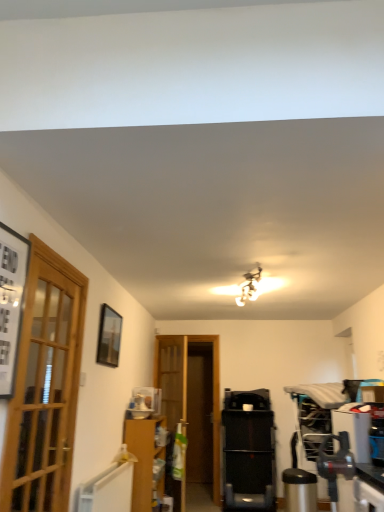
Find the location of a particular element. wooden door at center, placed as the first door when sorted from back to front is located at coordinates (172, 399).

Describe the element at coordinates (109, 336) in the screenshot. The image size is (384, 512). I see `matte black picture frame at upper left, which appears as the 1th picture frame when viewed from the right` at that location.

Measure the distance between matte black picture frame at upper left, which appears as the 1th picture frame when viewed from the right, and camera.

The distance of matte black picture frame at upper left, which appears as the 1th picture frame when viewed from the right, from camera is 3.26 meters.

Locate an element on the screen. Image resolution: width=384 pixels, height=512 pixels. black matte picture frame at left, which is counted as the 1th picture frame, starting from the front is located at coordinates (11, 302).

I want to click on wooden glass door at left, acting as the second door starting from the back, so click(45, 386).

From the image's perspective, is wooden glass door at left, acting as the second door starting from the back, positioned above or below matte black picture frame at upper left, which appears as the 1th picture frame when viewed from the right?

Based on their image positions, wooden glass door at left, acting as the second door starting from the back, is located beneath matte black picture frame at upper left, which appears as the 1th picture frame when viewed from the right.

Which object is thinner, wooden glass door at left, which is the 1th door from front to back, or matte black picture frame at upper left, which is the 2th picture frame in left-to-right order?

Thinner between the two is matte black picture frame at upper left, which is the 2th picture frame in left-to-right order.

Are wooden glass door at left, arranged as the second door when viewed from the right, and matte black picture frame at upper left, placed as the first picture frame when sorted from back to front, beside each other?

wooden glass door at left, arranged as the second door when viewed from the right, and matte black picture frame at upper left, placed as the first picture frame when sorted from back to front, are not in contact.

Is wooden glass door at left, arranged as the second door when viewed from the right, not within matte black picture frame at upper left, which is the 2th picture frame in left-to-right order?

wooden glass door at left, arranged as the second door when viewed from the right, lies outside matte black picture frame at upper left, which is the 2th picture frame in left-to-right order,'s area.

Considering the sizes of objects matte black picture frame at upper left, placed as the first picture frame when sorted from back to front, and black plastic treadmill at center in the image provided, who is wider, matte black picture frame at upper left, placed as the first picture frame when sorted from back to front, or black plastic treadmill at center?

Wider between the two is black plastic treadmill at center.

The width and height of the screenshot is (384, 512). I want to click on the 1st picture frame counting from the left of the black plastic treadmill at center, so click(x=109, y=336).

Is matte black picture frame at upper left, which is counted as the second picture frame, starting from the front, positioned in front of black plastic treadmill at center?

Yes, matte black picture frame at upper left, which is counted as the second picture frame, starting from the front, is closer to the viewer.

Is matte black picture frame at upper left, which is counted as the second picture frame, starting from the front, looking in the opposite direction of black plastic treadmill at center?

No, black plastic treadmill at center is not at the back of matte black picture frame at upper left, which is counted as the second picture frame, starting from the front.

Is black plastic treadmill at center closer to camera compared to wooden door at center, marked as the second door in a front-to-back arrangement?

Yes, it is.

The width and height of the screenshot is (384, 512). Identify the location of door behind the black plastic treadmill at center. (172, 399).

Considering the relative sizes of black plastic treadmill at center and wooden door at center, the 2th door from the left, in the image provided, is black plastic treadmill at center bigger than wooden door at center, the 2th door from the left,?

Yes.

From a real-world perspective, which object stands above the other?

wooden door at center, placed as the first door when sorted from back to front, is physically above.

Is brown cardboard cabinet at lower left positioned with its back to wooden glass door at left, which is the 1th door from front to back?

brown cardboard cabinet at lower left does not have its back to wooden glass door at left, which is the 1th door from front to back.

From the image's perspective, which object appears higher, brown cardboard cabinet at lower left or wooden glass door at left, which is the 1th door from front to back?

wooden glass door at left, which is the 1th door from front to back.

Does brown cardboard cabinet at lower left come behind wooden glass door at left, acting as the second door starting from the back?

Yes, the depth of brown cardboard cabinet at lower left is greater than that of wooden glass door at left, acting as the second door starting from the back.

Where is `the 2nd door above the brown cardboard cabinet at lower left (from the image's perspective)`? The height and width of the screenshot is (512, 384). the 2nd door above the brown cardboard cabinet at lower left (from the image's perspective) is located at coordinates (45, 386).

Could you tell me if black matte picture frame at left, which is the second picture frame from back to front, is facing black plastic treadmill at center?

No, black matte picture frame at left, which is the second picture frame from back to front, is not oriented towards black plastic treadmill at center.

Which point is more forward, (6, 372) or (249, 503)?

Point (6, 372)

Is black matte picture frame at left, positioned as the second picture frame in right-to-left order, at the left side of black plastic treadmill at center?

Yes.

Can black plastic treadmill at center be found inside black matte picture frame at left, which is counted as the 1th picture frame, starting from the front?

No.

Would you say wooden glass door at left, arranged as the second door when viewed from the right, is part of black matte picture frame at left, positioned as the second picture frame in right-to-left order,'s contents?

No, wooden glass door at left, arranged as the second door when viewed from the right, is located outside of black matte picture frame at left, positioned as the second picture frame in right-to-left order.

Which is more to the right, black matte picture frame at left, positioned as the second picture frame in right-to-left order, or wooden glass door at left, which is counted as the 1th door, starting from the left?

wooden glass door at left, which is counted as the 1th door, starting from the left.

Consider the image. Which object is thinner, black matte picture frame at left, which is counted as the 1th picture frame, starting from the front, or wooden glass door at left, arranged as the second door when viewed from the right?

Thinner between the two is black matte picture frame at left, which is counted as the 1th picture frame, starting from the front.

Is black matte picture frame at left, positioned as the second picture frame in right-to-left order, far away from wooden glass door at left, acting as the second door starting from the back?

No, there isn't a large distance between black matte picture frame at left, positioned as the second picture frame in right-to-left order, and wooden glass door at left, acting as the second door starting from the back.

Looking at this image, is matte black picture frame at upper left, placed as the first picture frame when sorted from back to front, oriented away from brown cardboard cabinet at lower left?

matte black picture frame at upper left, placed as the first picture frame when sorted from back to front, does not have its back to brown cardboard cabinet at lower left.

Can you confirm if matte black picture frame at upper left, placed as the first picture frame when sorted from back to front, is bigger than brown cardboard cabinet at lower left?

No, matte black picture frame at upper left, placed as the first picture frame when sorted from back to front, is not bigger than brown cardboard cabinet at lower left.

Is matte black picture frame at upper left, which is counted as the second picture frame, starting from the front, closer to the viewer compared to brown cardboard cabinet at lower left?

Yes, matte black picture frame at upper left, which is counted as the second picture frame, starting from the front, is closer to the viewer.

Based on the photo, is matte black picture frame at upper left, which is counted as the second picture frame, starting from the front, not close to brown cardboard cabinet at lower left?

Yes, matte black picture frame at upper left, which is counted as the second picture frame, starting from the front, and brown cardboard cabinet at lower left are located far from each other.

From the image's perspective, which picture frame is the 1st one above the wooden glass door at left, which is counted as the 1th door, starting from the left? Please provide its 2D coordinates.

[(109, 336)]

The width and height of the screenshot is (384, 512). Find the location of `appliance located behind the matte black picture frame at upper left, which appears as the 1th picture frame when viewed from the right`. appliance located behind the matte black picture frame at upper left, which appears as the 1th picture frame when viewed from the right is located at coordinates (248, 460).

From the image, which object appears to be farther from wooden door at center, the 1th door in the right-to-left sequence, wooden glass door at left, arranged as the second door when viewed from the right, or black matte picture frame at left, which is counted as the 1th picture frame, starting from the front?

black matte picture frame at left, which is counted as the 1th picture frame, starting from the front.

From the picture: Estimate the real-world distances between objects in this image. Which object is further from wooden glass door at left, which is the 1th door from front to back, black plastic treadmill at center or matte black picture frame at upper left, which appears as the 1th picture frame when viewed from the right?

black plastic treadmill at center is positioned further to the anchor wooden glass door at left, which is the 1th door from front to back.

When comparing their distances from black matte picture frame at left, positioned as the second picture frame in right-to-left order, does wooden door at center, placed as the first door when sorted from back to front, or matte black picture frame at upper left, placed as the first picture frame when sorted from back to front, seem closer?

matte black picture frame at upper left, placed as the first picture frame when sorted from back to front, is closer to black matte picture frame at left, positioned as the second picture frame in right-to-left order.

Considering their positions, is black matte picture frame at left, which is counted as the 1th picture frame, starting from the front, positioned closer to matte black picture frame at upper left, which is the 2th picture frame in left-to-right order, than brown cardboard cabinet at lower left?

brown cardboard cabinet at lower left is positioned closer to the anchor matte black picture frame at upper left, which is the 2th picture frame in left-to-right order.

Looking at the image, which one is located closer to black plastic treadmill at center, wooden door at center, marked as the second door in a front-to-back arrangement, or wooden glass door at left, arranged as the second door when viewed from the right?

wooden door at center, marked as the second door in a front-to-back arrangement, is closer to black plastic treadmill at center.

From the image, which object appears to be farther from wooden door at center, the 2th door from the left, black matte picture frame at left, which is the second picture frame from back to front, or matte black picture frame at upper left, placed as the first picture frame when sorted from back to front?

black matte picture frame at left, which is the second picture frame from back to front, is positioned further to the anchor wooden door at center, the 2th door from the left.

Estimate the real-world distances between objects in this image. Which object is closer to wooden glass door at left, which is the 1th door from front to back, black matte picture frame at left, positioned as the second picture frame in right-to-left order, or brown cardboard cabinet at lower left?

black matte picture frame at left, positioned as the second picture frame in right-to-left order.

Which object lies further to the anchor point brown cardboard cabinet at lower left, wooden glass door at left, arranged as the second door when viewed from the right, or wooden door at center, marked as the second door in a front-to-back arrangement?

wooden glass door at left, arranged as the second door when viewed from the right, is further to brown cardboard cabinet at lower left.

Where is `picture frame positioned between wooden glass door at left, which is counted as the 1th door, starting from the left, and wooden door at center, placed as the first door when sorted from back to front, from near to far`? The height and width of the screenshot is (512, 384). picture frame positioned between wooden glass door at left, which is counted as the 1th door, starting from the left, and wooden door at center, placed as the first door when sorted from back to front, from near to far is located at coordinates (109, 336).

What are the coordinates of `cabinetry positioned between wooden glass door at left, acting as the second door starting from the back, and black plastic treadmill at center from near to far` in the screenshot? It's located at (143, 458).

You are a GUI agent. You are given a task and a screenshot of the screen. Output one action in this format:
    pyautogui.click(x=<x>, y=<y>)
    Task: Click on the cabinetry between black matte picture frame at left, which is the second picture frame from back to front, and black plastic treadmill at center from front to back
    
    Given the screenshot: What is the action you would take?
    pyautogui.click(x=143, y=458)

At what (x,y) coordinates should I click in order to perform the action: click on door between brown cardboard cabinet at lower left and black plastic treadmill at center from left to right. Please return your answer as a coordinate pair (x, y). The image size is (384, 512). Looking at the image, I should click on (172, 399).